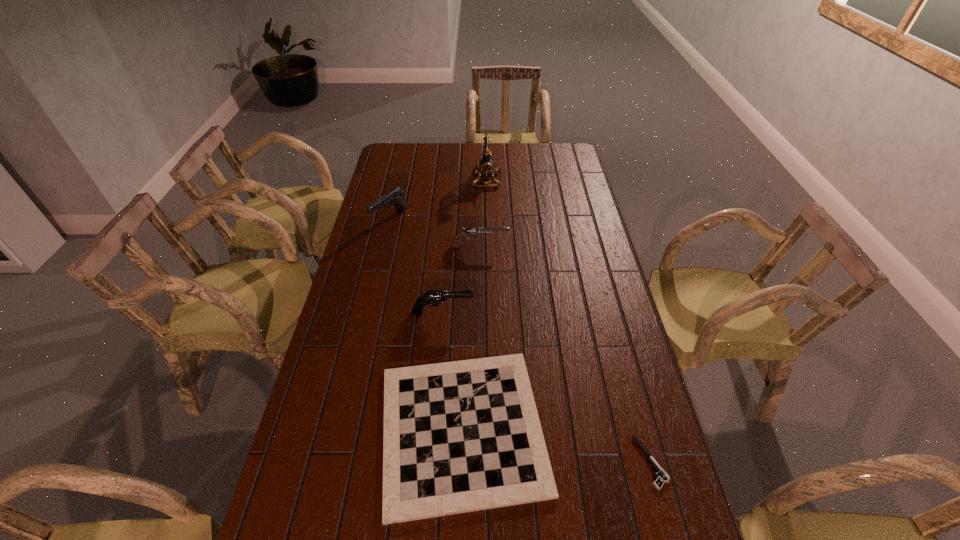
Identify the location of free space between the shortest object and the second tallest gun. The image size is (960, 540). 547,388.

Image resolution: width=960 pixels, height=540 pixels. In order to click on vacant area that lies between the fourth shortest object and the pistol in this screenshot , I will do `click(547, 388)`.

Locate an element on the screen. The width and height of the screenshot is (960, 540). free space between the third nearest object and the leftmost gun is located at coordinates (417, 266).

Where is `blank region between the nearest gun and the shortest object`? The image size is (960, 540). blank region between the nearest gun and the shortest object is located at coordinates (547, 388).

Find the location of a particular element. free space between the second shortest object and the leftmost object is located at coordinates (426, 324).

At what (x,y) coordinates should I click in order to perform the action: click on free space between the leftmost object and the checkerboard. Please return your answer as a coordinate pair (x, y). This screenshot has height=540, width=960. Looking at the image, I should click on (426, 324).

Locate an element on the screen. This screenshot has width=960, height=540. vacant area between the pistol and the farthest object is located at coordinates (569, 321).

Locate an element on the screen. This screenshot has width=960, height=540. vacant area that lies between the rightmost object and the fourth shortest object is located at coordinates (547, 388).

Identify the location of the third closest object to the third shortest object. This screenshot has height=540, width=960. (486, 166).

Identify which object is located as the second nearest to the shortest gun. Please provide its 2D coordinates. Your answer should be formatted as a tuple, i.e. [(x, y)], where the tuple contains the x and y coordinates of a point satisfying the conditions above.

[(434, 297)]